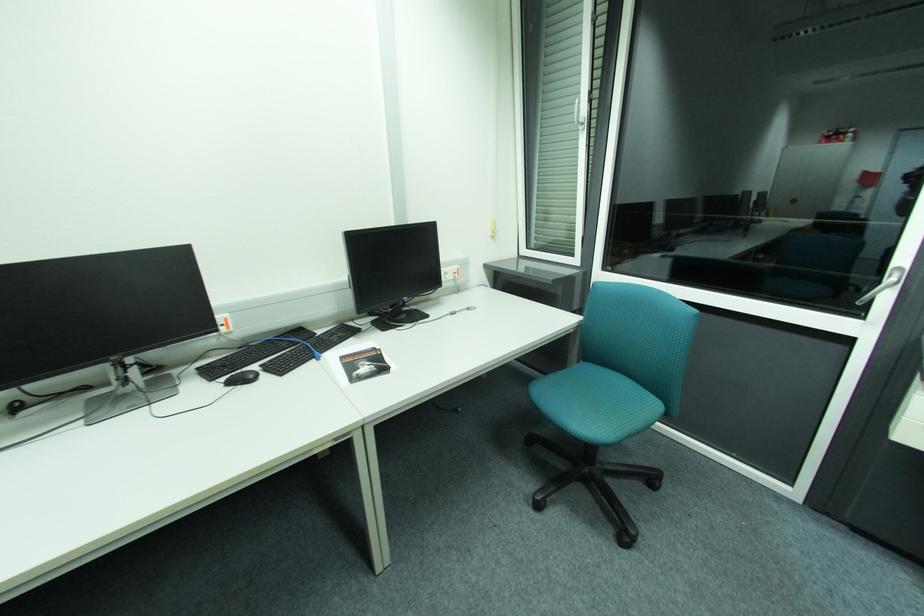
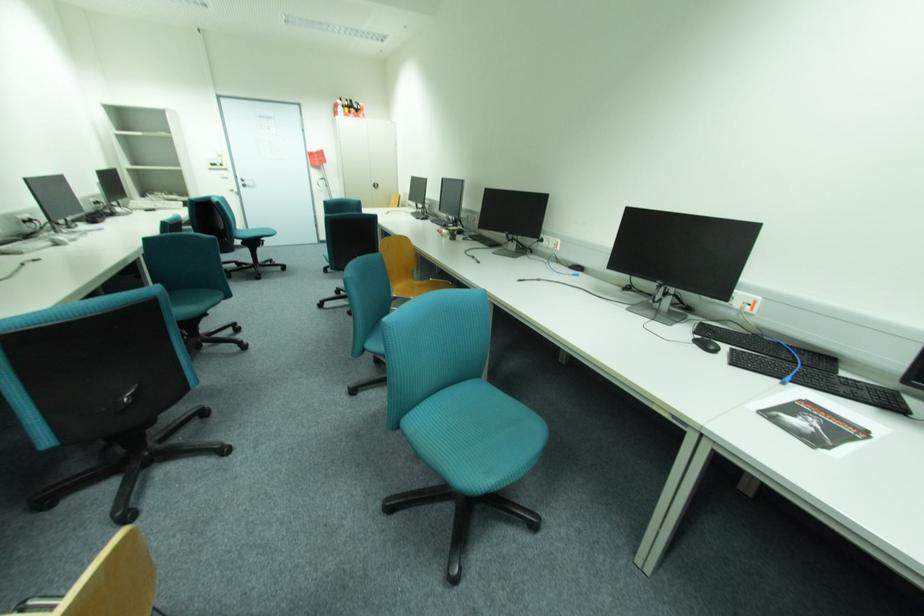
Where in the second image is the point corresponding to (x=346, y=334) from the first image?

(870, 392)